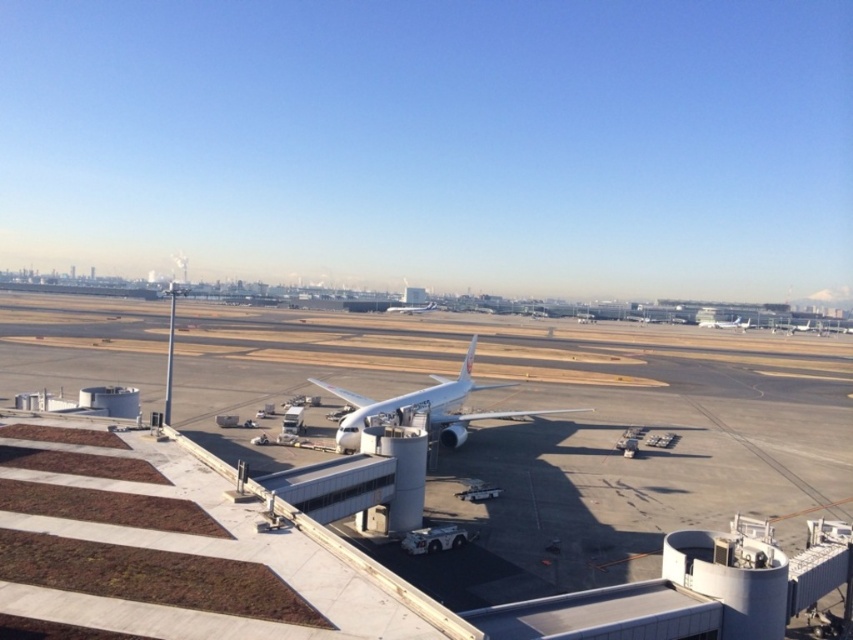
Does white smooth tarmac at center appear under white matte airplane at center-right?

Yes.

Can you confirm if white smooth tarmac at center is shorter than white matte airplane at center-right?

No, white smooth tarmac at center is not shorter than white matte airplane at center-right.

The width and height of the screenshot is (853, 640). I want to click on white smooth tarmac at center, so click(x=550, y=429).

Is white glossy airplane at center thinner than white matte airplane at center-right?

Incorrect, white glossy airplane at center's width is not less than white matte airplane at center-right's.

Who is positioned more to the left, white glossy airplane at center or white matte airplane at center-right?

Positioned to the left is white glossy airplane at center.

Who is more distant from viewer, (454, 440) or (730, 321)?

Point (730, 321)

Find the location of a particular element. white glossy airplane at center is located at coordinates (422, 404).

Is point (666, 449) more distant than point (393, 422)?

Yes, it is behind point (393, 422).

In the scene shown: Measure the distance between point (642, 572) and camera.

A distance of 17.51 meters exists between point (642, 572) and camera.

Who is more forward, (196, 320) or (383, 413)?

Positioned in front is point (383, 413).

You are a GUI agent. You are given a task and a screenshot of the screen. Output one action in this format:
    pyautogui.click(x=<x>, y=<y>)
    Task: Click on the white smooth tarmac at center
    The width and height of the screenshot is (853, 640).
    Given the screenshot: What is the action you would take?
    pyautogui.click(x=550, y=429)